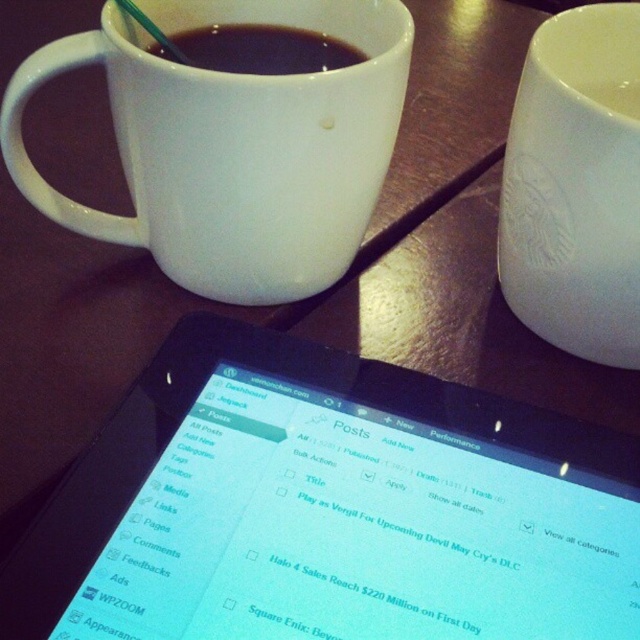
Question: Which point appears closest to the camera in this image?

Choices:
 (A) (273, 19)
 (B) (240, 36)

Answer: (B)

Question: From the image, what is the correct spatial relationship of black glossy tablet at center in relation to white ceramic mug at upper right?

Choices:
 (A) above
 (B) below

Answer: (B)

Question: Among these objects, which one is farthest from the camera?

Choices:
 (A) white glossy mug at upper center
 (B) black glossy tablet at center
 (C) matte white cup at upper center

Answer: (C)

Question: Does white glossy mug at upper center have a larger size compared to matte white cup at upper center?

Choices:
 (A) no
 (B) yes

Answer: (B)

Question: Which object appears closest to the camera in this image?

Choices:
 (A) white glossy mug at upper center
 (B) matte white cup at upper center
 (C) white ceramic mug at upper right

Answer: (C)

Question: Does black glossy tablet at center have a lesser width compared to white ceramic mug at upper right?

Choices:
 (A) no
 (B) yes

Answer: (A)